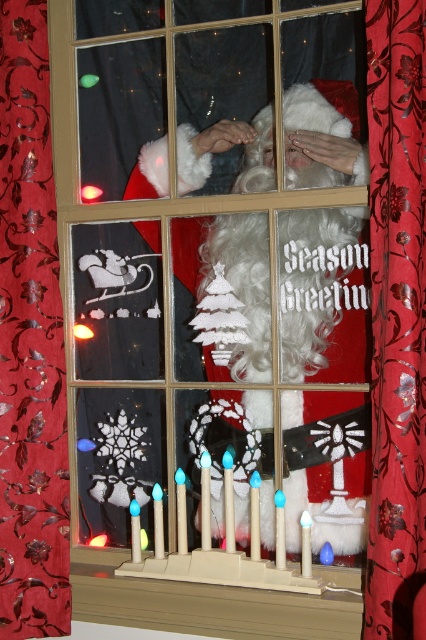
In the scene shown: You are a small toy that is 12 inches long. You want to move from the red velvet curtain at center to the beige wood at lower center. Can you fit through the space between them?

The red velvet curtain at center and beige wood at lower center are 14.67 inches apart from each other. Since you are 12 inches long, you can fit through the space between them as 14.67 inches is wider than your length.

You are standing in front of the holiday window display and notice a point marked at coordinates (29, 340). Based on the scene description, what object is located at that point?

The point at coordinates (29, 340) marks the location of the red floral fabric curtain at left.